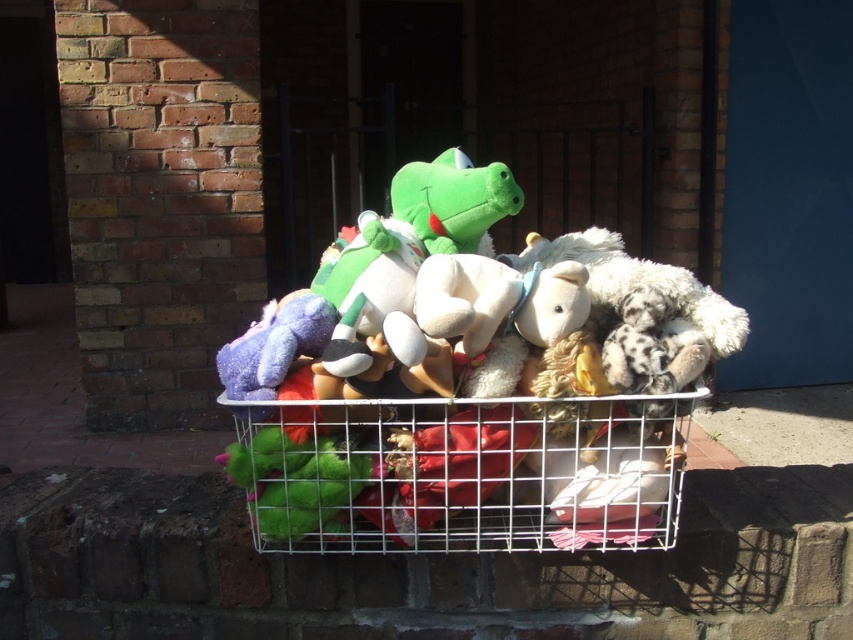
Question: Does soft plush toys at center have a lesser width compared to white wire shopping basket at center?

Choices:
 (A) no
 (B) yes

Answer: (A)

Question: Which point appears closest to the camera in this image?

Choices:
 (A) (386, 483)
 (B) (573, 474)

Answer: (A)

Question: Which object appears closest to the camera in this image?

Choices:
 (A) soft plush toys at center
 (B) white wire shopping basket at center

Answer: (A)

Question: Does soft plush toys at center appear on the right side of white wire shopping basket at center?

Choices:
 (A) yes
 (B) no

Answer: (A)

Question: Is soft plush toys at center closer to the viewer compared to white wire shopping basket at center?

Choices:
 (A) yes
 (B) no

Answer: (A)